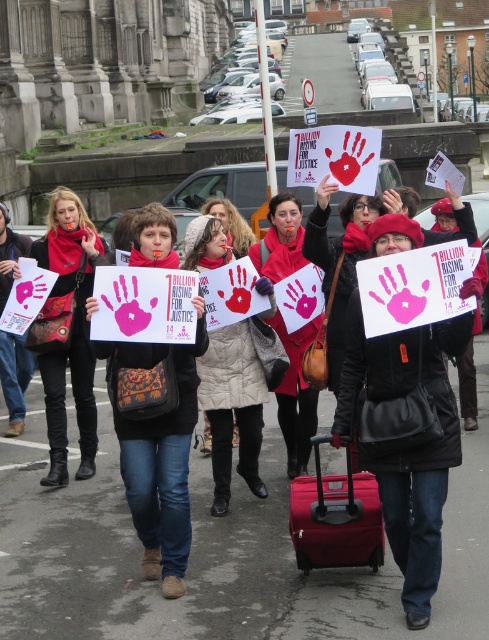
Question: Does matte black scarf at center appear on the left side of matte red coat at center?

Choices:
 (A) no
 (B) yes

Answer: (B)

Question: Where is matte red coat at center located in relation to matte gray coat at center in the image?

Choices:
 (A) right
 (B) left

Answer: (A)

Question: Which object appears farthest from the camera in this image?

Choices:
 (A) matte gray coat at center
 (B) matte red coat at center

Answer: (A)

Question: Which point appears closest to the camera in this image?

Choices:
 (A) (208, 208)
 (B) (355, 552)
 (C) (299, 221)

Answer: (B)

Question: Which object is farther from the camera taking this photo?

Choices:
 (A) beige quilted coat at center
 (B) matte red suitcase at lower center

Answer: (A)

Question: Does matte black scarf at center appear on the left side of beige quilted coat at center?

Choices:
 (A) no
 (B) yes

Answer: (B)